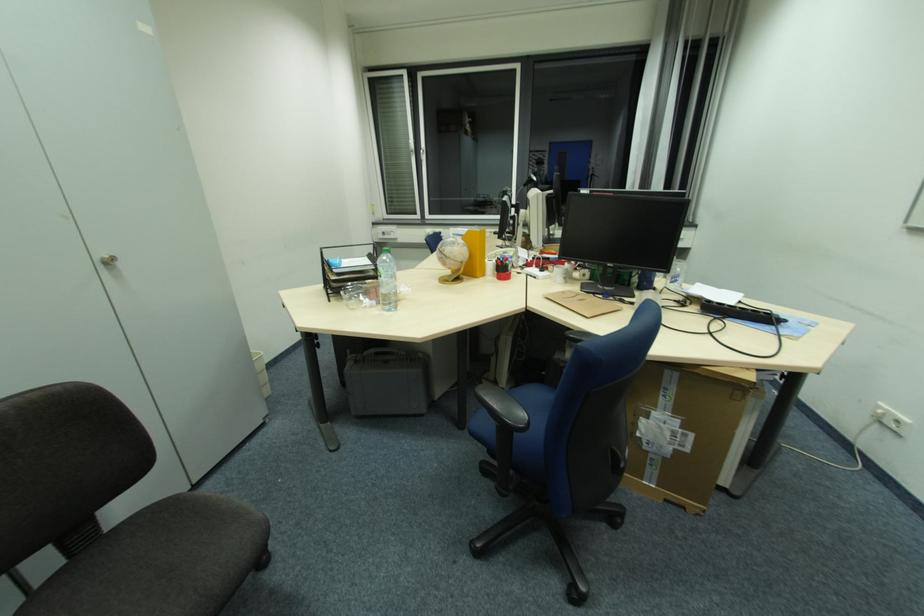
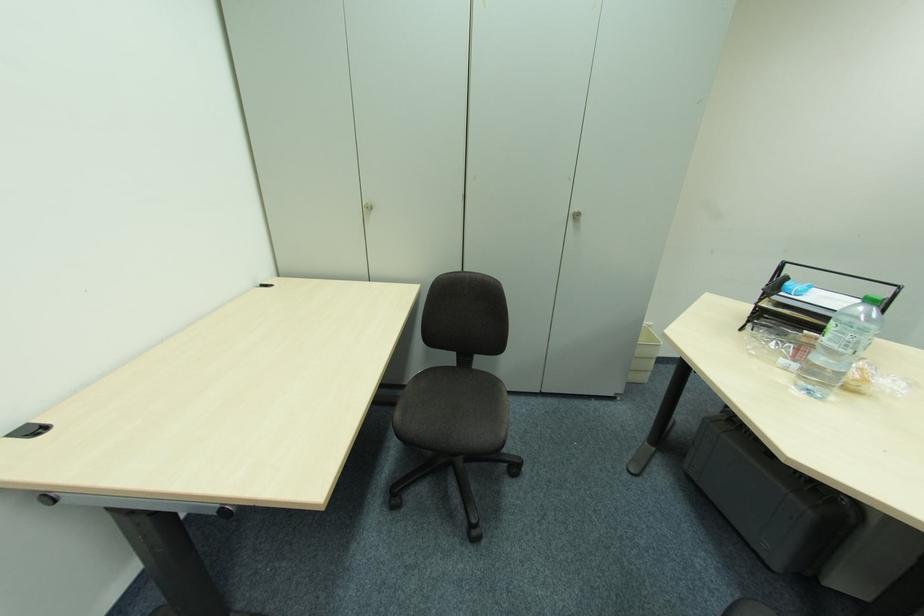
Where in the second image is the point corresponding to (117,530) from the first image?

(477, 371)